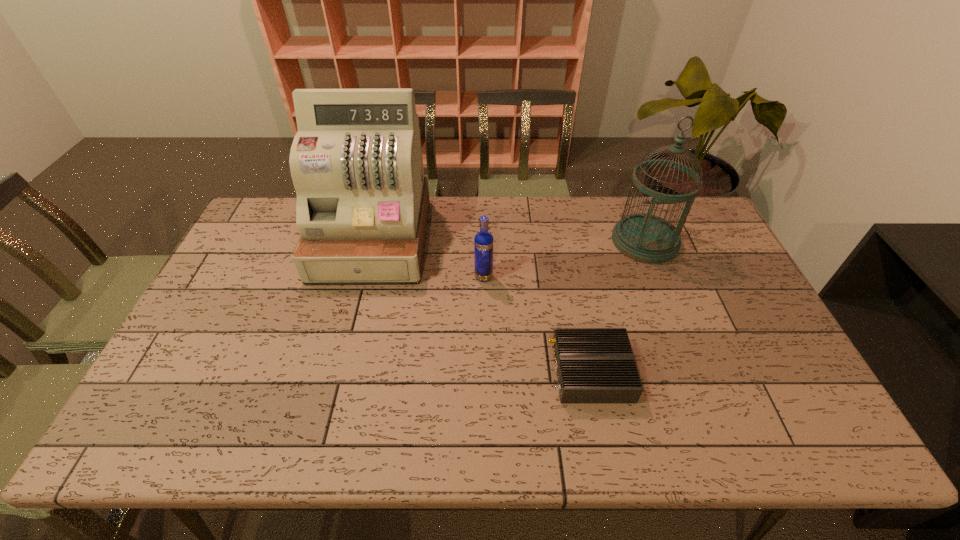
Identify the location of the leftmost object. (356, 163).

Locate an element on the screen. The image size is (960, 540). birdcage is located at coordinates (647, 238).

The image size is (960, 540). I want to click on the third object from right to left, so click(483, 242).

Where is `the second shortest object`? The width and height of the screenshot is (960, 540). the second shortest object is located at coordinates (483, 242).

You are a GUI agent. You are given a task and a screenshot of the screen. Output one action in this format:
    pyautogui.click(x=<x>, y=<y>)
    Task: Click on the nearest object
    This screenshot has width=960, height=540.
    Given the screenshot: What is the action you would take?
    pyautogui.click(x=593, y=365)

Where is `the shortest object`? the shortest object is located at coordinates coord(593,365).

Identify the location of free space located on the operating side of the cash register. This screenshot has height=540, width=960. (332, 395).

This screenshot has width=960, height=540. I want to click on free point located on the front-facing side of the birdcage, so click(678, 325).

Identify the location of vacant space located on the back of the third tallest object. The height and width of the screenshot is (540, 960). (484, 255).

What are the coordinates of `free region located on the back panel of the router` in the screenshot? It's located at (459, 372).